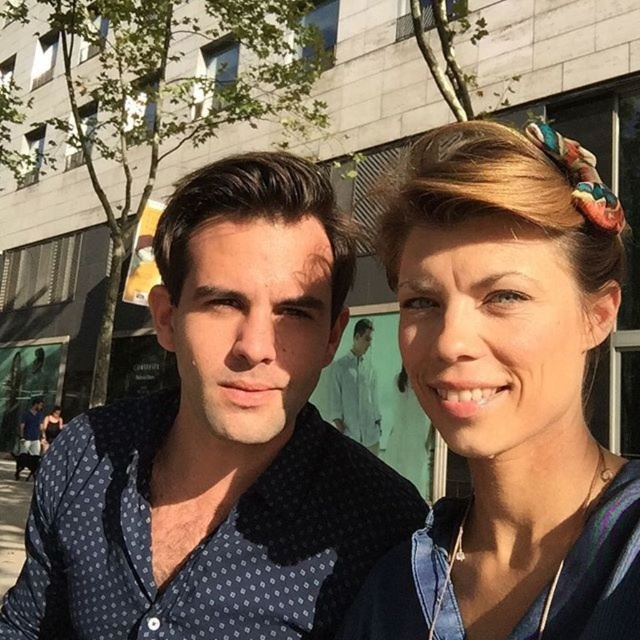
Can you confirm if blue dotted shirt at center is smaller than blue fabric headband at upper right?

Actually, blue dotted shirt at center might be larger than blue fabric headband at upper right.

The image size is (640, 640). What do you see at coordinates (218, 440) in the screenshot?
I see `blue dotted shirt at center` at bounding box center [218, 440].

I want to click on blue dotted shirt at center, so click(218, 440).

Who is taller, blue dotted shirt at center or white smooth shirt at center?

With more height is white smooth shirt at center.

Can you confirm if blue dotted shirt at center is positioned above white smooth shirt at center?

Indeed, blue dotted shirt at center is positioned over white smooth shirt at center.

Does point (134, 449) lie behind point (368, 416)?

No.

At what (x,y) coordinates should I click in order to perform the action: click on blue dotted shirt at center. Please return your answer as a coordinate pair (x, y). The image size is (640, 640). Looking at the image, I should click on (218, 440).

I want to click on blue fabric headband at upper right, so click(x=508, y=392).

Which is more to the left, blue fabric headband at upper right or white smooth shirt at center?

blue fabric headband at upper right is more to the left.

Find the location of a particular element. blue fabric headband at upper right is located at coordinates (508, 392).